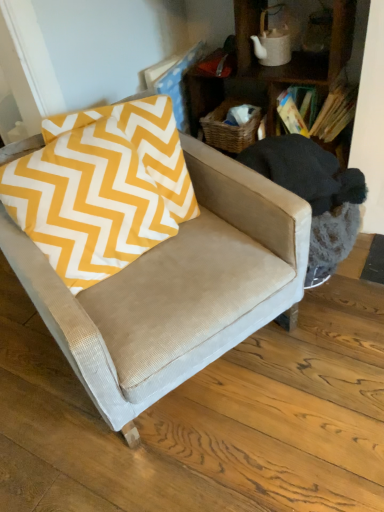
Question: Is wooden bookshelf at upper right thinner than suede-like beige swivel chair at center?

Choices:
 (A) yes
 (B) no

Answer: (A)

Question: Considering the relative sizes of wooden bookshelf at upper right and suede-like beige swivel chair at center in the image provided, is wooden bookshelf at upper right taller than suede-like beige swivel chair at center?

Choices:
 (A) no
 (B) yes

Answer: (B)

Question: From the image's perspective, is wooden bookshelf at upper right on suede-like beige swivel chair at center?

Choices:
 (A) no
 (B) yes

Answer: (B)

Question: Is wooden bookshelf at upper right at the left side of suede-like beige swivel chair at center?

Choices:
 (A) yes
 (B) no

Answer: (A)

Question: Does wooden bookshelf at upper right have a lesser height compared to suede-like beige swivel chair at center?

Choices:
 (A) no
 (B) yes

Answer: (A)

Question: Based on their sizes in the image, would you say suede-like beige swivel chair at center is bigger or smaller than suede-like beige armchair at center?

Choices:
 (A) small
 (B) big

Answer: (A)

Question: Considering the positions of suede-like beige swivel chair at center and suede-like beige armchair at center in the image, is suede-like beige swivel chair at center wider or thinner than suede-like beige armchair at center?

Choices:
 (A) wide
 (B) thin

Answer: (B)

Question: In the image, is suede-like beige swivel chair at center positioned in front of or behind suede-like beige armchair at center?

Choices:
 (A) front
 (B) behind

Answer: (B)

Question: From the image's perspective, is suede-like beige swivel chair at center located above or below suede-like beige armchair at center?

Choices:
 (A) above
 (B) below

Answer: (A)

Question: Would you say suede-like beige swivel chair at center is inside or outside wooden bookshelf at upper right?

Choices:
 (A) outside
 (B) inside

Answer: (A)

Question: Is point (342, 208) positioned closer to the camera than point (342, 2)?

Choices:
 (A) closer
 (B) farther

Answer: (B)

Question: From the image's perspective, is suede-like beige swivel chair at center located above or below wooden bookshelf at upper right?

Choices:
 (A) above
 (B) below

Answer: (B)

Question: Is suede-like beige swivel chair at center wider or thinner than wooden bookshelf at upper right?

Choices:
 (A) wide
 (B) thin

Answer: (A)

Question: Does point (271, 192) appear closer or farther from the camera than point (249, 14)?

Choices:
 (A) farther
 (B) closer

Answer: (B)

Question: Would you say suede-like beige armchair at center is inside or outside wooden bookshelf at upper right?

Choices:
 (A) outside
 (B) inside

Answer: (A)